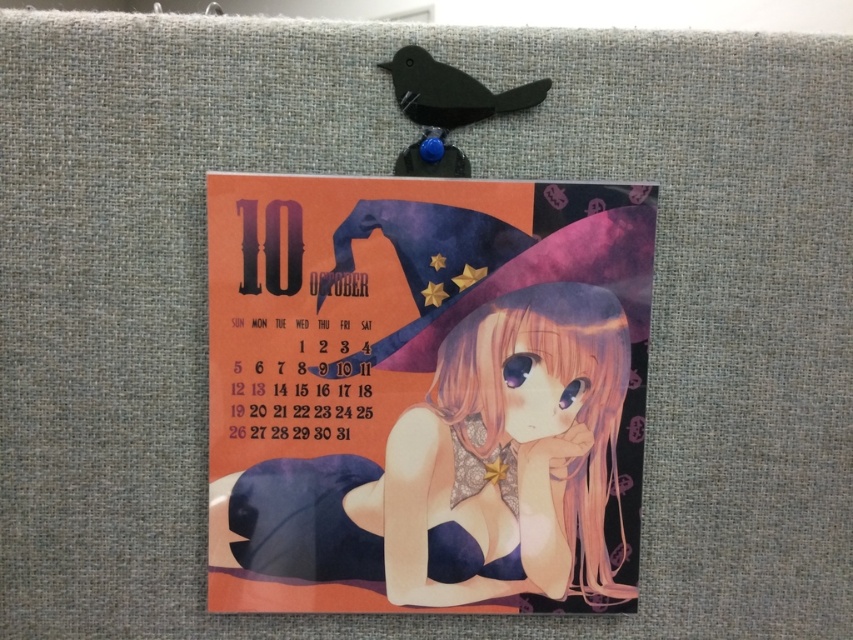
You are organizing a Halloween party and need to check the calendar. You have a decorative item that is 10 cm wide. Can you place it on the calendar without covering the dates? Please consider the size of the smooth paper calendar at center and the matte black bird at upper center.

The smooth paper calendar at center is larger in size than the matte black bird at upper center. Since the calendar is bigger than the bird clip, there should be enough space to place the 10 cm wide decorative item on the calendar without covering the dates.

You are trying to hang a new photo frame that is 15 cm wide on the same fabric surface where the smooth paper calendar at center and the matte black bird at upper center are located. The photo frame is as wide as the calendar. Will the photo frame fit horizontally between the two objects?

The smooth paper calendar at center is much taller than the matte black bird at upper center, but since the photo frame is as wide as the calendar, it will fit horizontally between them only if there is enough space. However, the description only provides information about their height, not their width or horizontal positioning. Therefore, it is impossible to determine if the photo frame will fit horizontally between the smooth paper calendar at center and the matte black bird at upper center based on the g

You are hanging a small clock that is 1.5 inches in diameter. You want to place it near the matte black bird at upper center but also ensure it doesn not cover the smooth paper calendar at center. Is there enough space between them?

The smooth paper calendar at center is 7.42 inches from the matte black bird at upper center. Since the clock is only 1.5 inches in diameter, there is sufficient space to place it near the matte black bird at upper center without covering the smooth paper calendar at center.